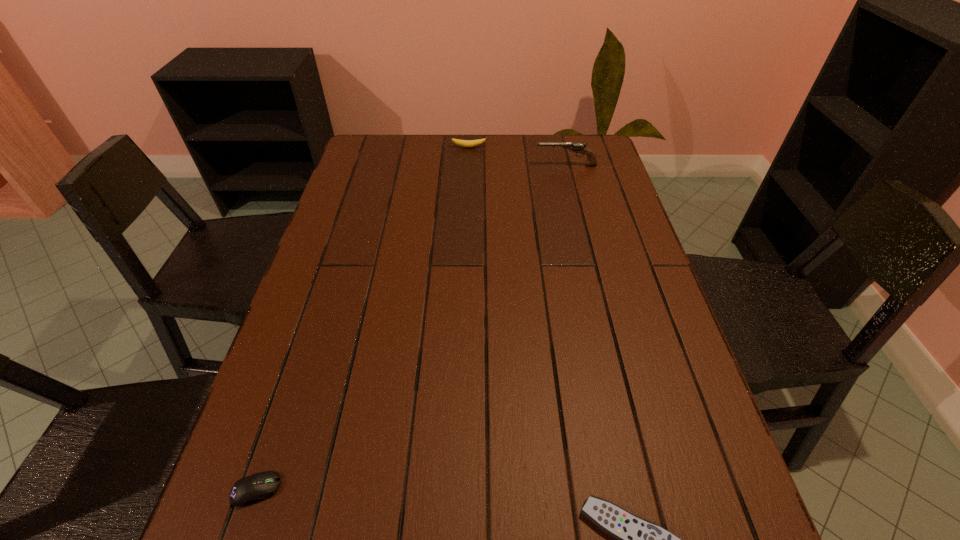
Find the location of a particular element. free space located on the back of the computer equipment is located at coordinates (272, 444).

Where is `gun positioned at the far edge`? gun positioned at the far edge is located at coordinates (578, 147).

Locate an element on the screen. banana that is at the far edge is located at coordinates (465, 143).

Where is `object at the left edge`? object at the left edge is located at coordinates (260, 486).

Identify the location of object situated at the right edge. (578, 147).

Identify the location of object present at the far right corner. click(578, 147).

At what (x,y) coordinates should I click in order to perform the action: click on free region at the far edge. Please return your answer as a coordinate pair (x, y). This screenshot has width=960, height=540. Looking at the image, I should click on (542, 151).

Where is `vacant region at the left edge of the desktop`? This screenshot has width=960, height=540. vacant region at the left edge of the desktop is located at coordinates (362, 208).

I want to click on free space at the right edge, so pyautogui.click(x=606, y=225).

The image size is (960, 540). I want to click on vacant space at the far right corner, so click(610, 170).